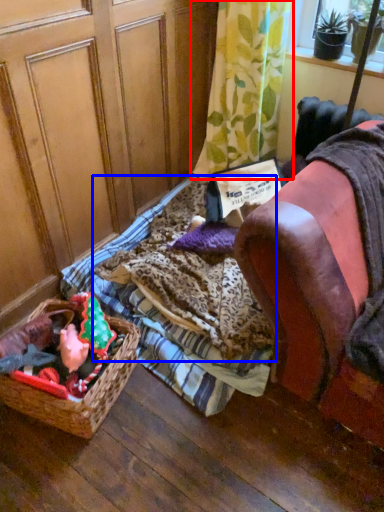
Question: Among these objects, which one is nearest to the camera, curtain (highlighted by a red box) or blanket (highlighted by a blue box)?

Choices:
 (A) curtain
 (B) blanket

Answer: (B)